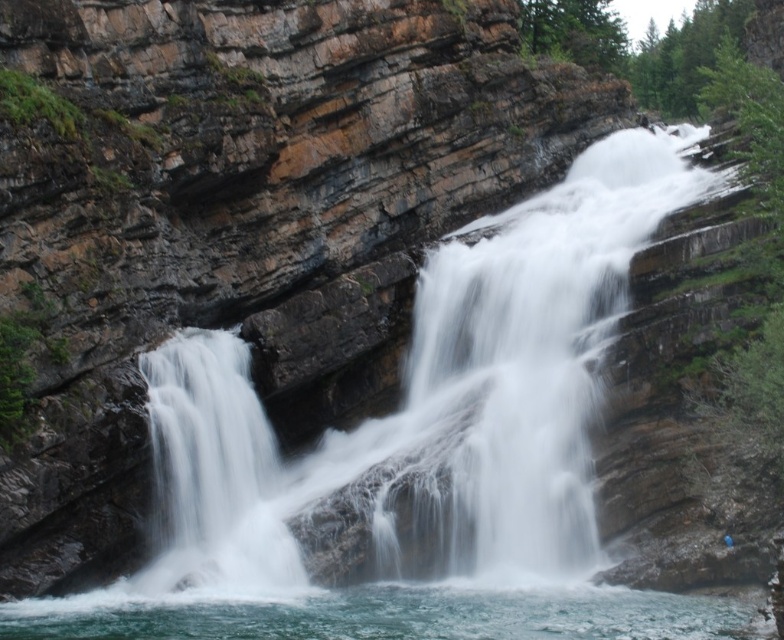
You are standing at the edge of the waterfall and see the point marked at coordinates (x=429, y=404). What type of water feature would you expect to find there?

At point (x=429, y=404) lies white frothy water at center, so you would expect to find white frothy water at center there.